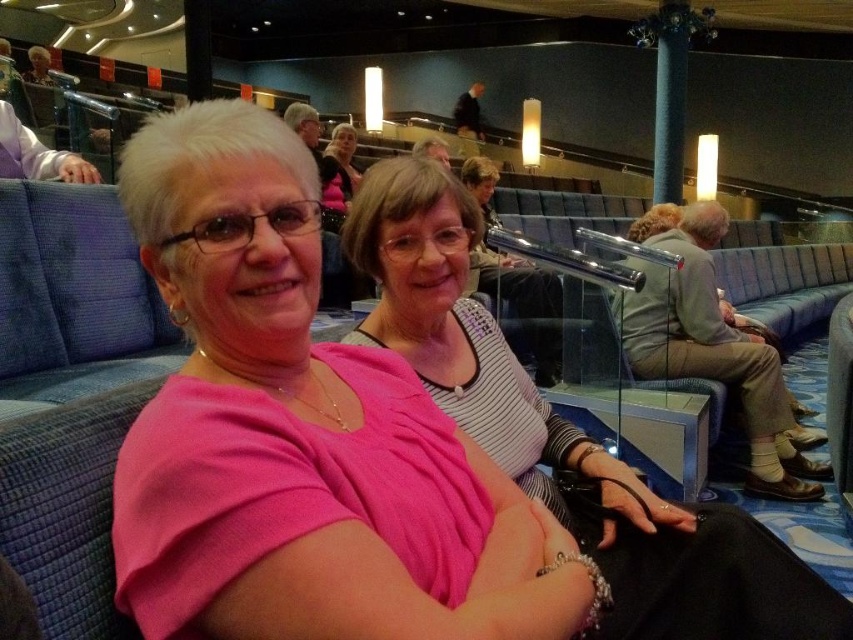
You are standing in the theater and want to move from point A to point B. Point A is at coordinates point (514, 372) and point B is at coordinates point (352, 186). Which point is closer to you if you are facing the stage?

Point (514, 372) is closer to the viewer than point (352, 186), so point A is closer.

You are designing a new bench for the theater and need to ensure there is enough space between the striped fabric shirt at center and the matte black shirt at center. Based on the image, which shirt takes up more horizontal space?

The striped fabric shirt at center takes up more horizontal space since its width is larger than the matte black shirt at center.

You are standing at the entrance of the theater and want to find the pink fabric shirt at center. According to the coordinates provided, in which direction should you look to locate it?

The pink fabric shirt at center is located at coordinates point (364, 458), so you should look towards the upper right direction from your current position at the entrance.